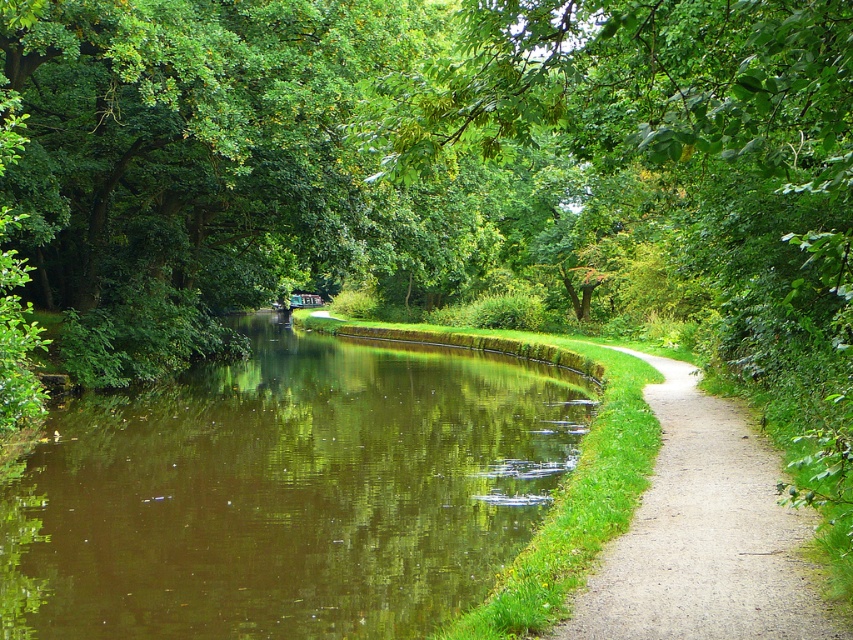
You are a tourist walking along the canal and want to take a photo of the brown reflective water at center and the green leafy tree at center. Based on their positions, which object should you focus on first to ensure both are in the frame?

The brown reflective water at center is positioned on the left side of green leafy tree at center, so you should focus on the brown reflective water at center first to ensure both are in the frame.